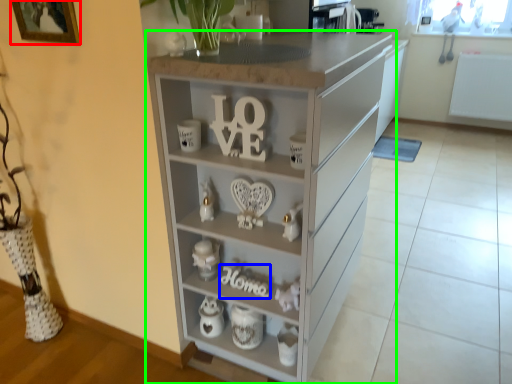
Question: Which object is the farthest from picture frame (highlighted by a red box)? Choose among these: alphabet (highlighted by a blue box) or chest of drawers (highlighted by a green box).

Choices:
 (A) alphabet
 (B) chest of drawers

Answer: (A)